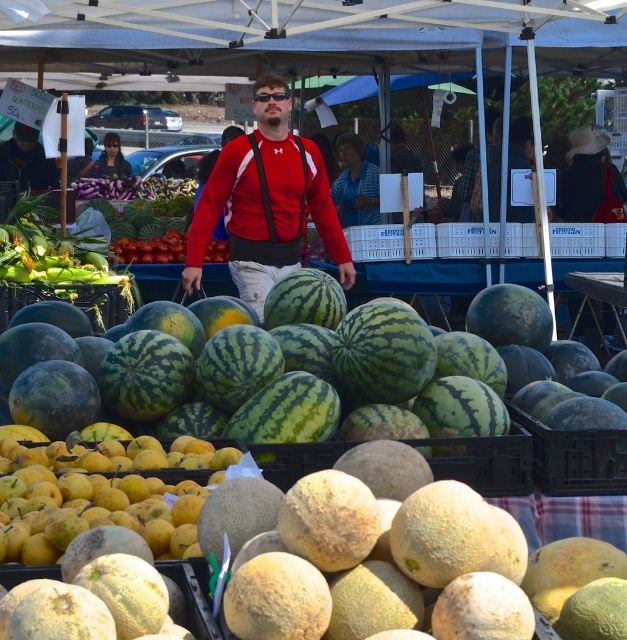
Is point (122, 394) behind point (213, 228)?

No, (122, 394) is closer to viewer.

Identify the location of green striped watermelon at center. This screenshot has width=627, height=640. (271, 378).